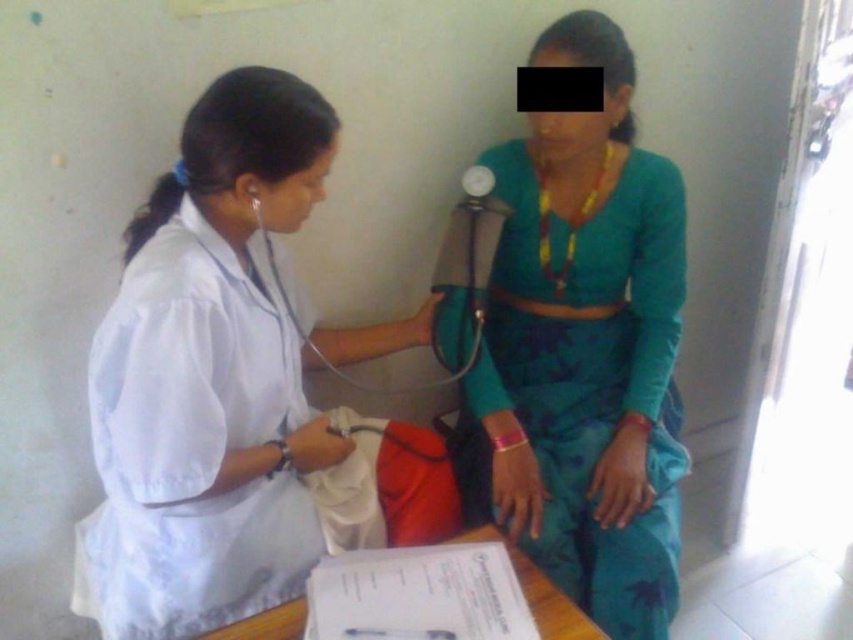
You are a patient in the room and want to hand a document to the healthcare professional wearing the white matte lab coat at center. The document is on the teal fabric dress at center. Can you reach it without moving from your current position?

The white matte lab coat at center is closer to the viewer than the teal fabric dress at center, so the healthcare professional can easily reach the document on the teal fabric dress at center from their current position.

You are an observer in the room. You see the white matte lab coat at center and the teal fabric dress at center. Which object takes up more space in the scene?

The white matte lab coat at center is larger in size than the teal fabric dress at center, so it takes up more space in the scene.